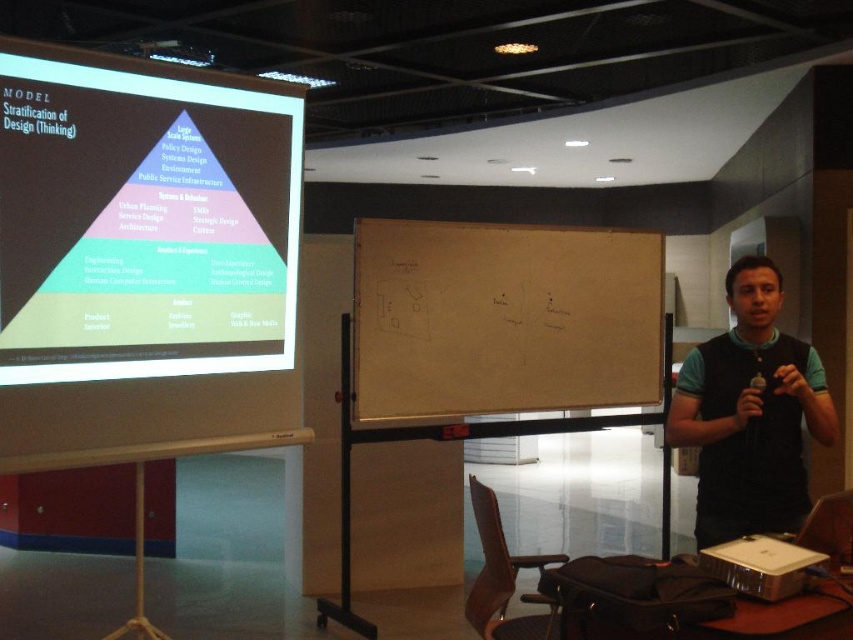
Between matte projector screen at upper left and white chalkboard at center, which one has less height?

white chalkboard at center

Does point (218, 184) come closer to viewer compared to point (566, 282)?

Yes, point (218, 184) is in front of point (566, 282).

Is point (119, 429) positioned before point (399, 396)?

Yes.

You are a GUI agent. You are given a task and a screenshot of the screen. Output one action in this format:
    pyautogui.click(x=<x>, y=<y>)
    Task: Click on the matte projector screen at upper left
    
    Given the screenshot: What is the action you would take?
    pyautogui.click(x=143, y=257)

Describe the element at coordinates (503, 317) in the screenshot. This screenshot has height=640, width=853. I see `white chalkboard at center` at that location.

Looking at this image, who is lower down, white chalkboard at center or black fabric vest at right?

black fabric vest at right is below.

Between point (376, 365) and point (743, 291), which one is positioned in front?

Point (743, 291)

This screenshot has width=853, height=640. I want to click on white chalkboard at center, so click(503, 317).

Between point (163, 348) and point (732, 300), which one is positioned behind?

The point (163, 348) is behind.

Does matte projector screen at upper left appear on the left side of black fabric vest at right?

Yes, matte projector screen at upper left is to the left of black fabric vest at right.

Between point (48, 45) and point (727, 525), which one is positioned behind?

The point (727, 525) is more distant.

Identify the location of matte projector screen at upper left. (143, 257).